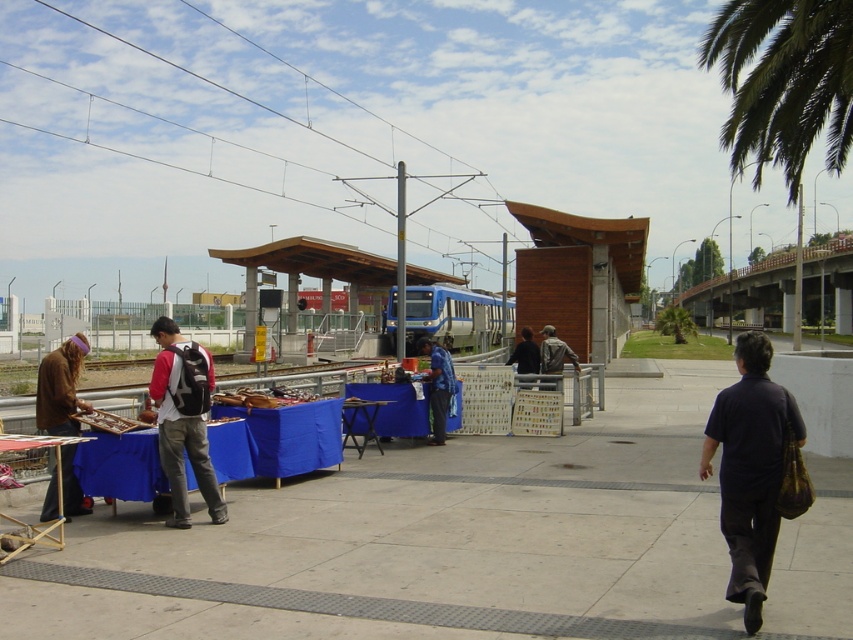
Question: Does dark blue shirt at right have a larger size compared to blue fabric shirt at center?

Choices:
 (A) no
 (B) yes

Answer: (B)

Question: Which of the following is the farthest from the observer?

Choices:
 (A) (440, 348)
 (B) (166, 474)

Answer: (A)

Question: Estimate the real-world distances between objects in this image. Which object is farther from the matte black backpack at center?

Choices:
 (A) brown fuzzy jacket at lower left
 (B) dark blue shirt at right

Answer: (B)

Question: Among these objects, which one is nearest to the camera?

Choices:
 (A) dark blue shirt at right
 (B) blue fabric shirt at center

Answer: (A)

Question: Does blue fabric shirt at center have a smaller size compared to dark blue shirt at center?

Choices:
 (A) yes
 (B) no

Answer: (A)

Question: Is dark blue shirt at right above blue metallic train at center?

Choices:
 (A) yes
 (B) no

Answer: (B)